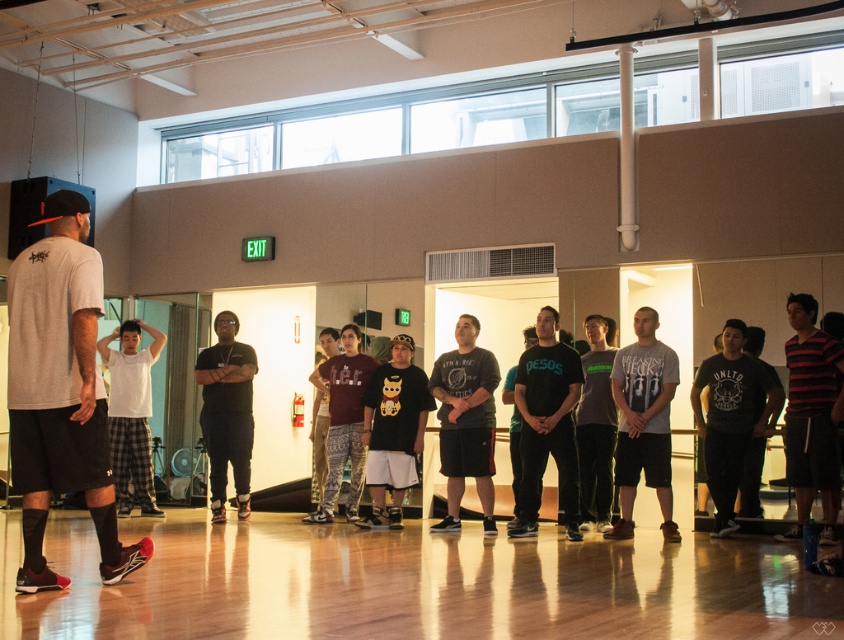
You are a photographer positioned at the back of the dance studio. You want to take a photo that includes both the striped cotton shirt at right and the black matte pants at center. Which object should you focus on first to ensure both are in sharp focus?

You should focus on the striped cotton shirt at right first because it is closer to the viewer than the black matte pants at center. By focusing on the closer object, the farther one may still be in focus depending on the depth of field.

You are a photographer setting up for a group photo in the dance studio. You need to ensure that the striped cotton shirt at right and the black matte pants at center are both visible in the frame. Considering their heights, which object should you focus on to ensure both are in focus?

The striped cotton shirt at right is not as tall as black matte pants at center, so focusing on the black matte pants at center will ensure both are in focus since it is taller and can accommodate the shorter striped cotton shirt at right within the same focal plane.